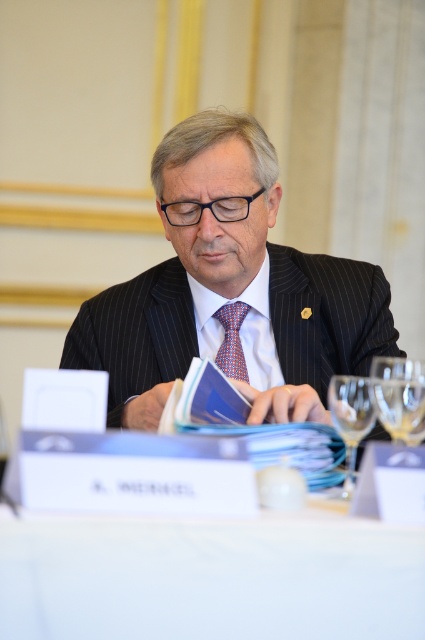
Who is higher up, white fabric table at center or transparent glass at right?

transparent glass at right is above.

Find the location of `white fabric table at center`. white fabric table at center is located at coordinates (209, 577).

Find the location of a particular element. The height and width of the screenshot is (640, 425). white fabric table at center is located at coordinates (209, 577).

Does white fabric table at center appear on the right side of transparent glass at lower right?

No, white fabric table at center is not to the right of transparent glass at lower right.

Does white fabric table at center lie in front of transparent glass at lower right?

Yes, it is in front of transparent glass at lower right.

Is point (418, 566) positioned after point (357, 445)?

No.

Identify the location of white fabric table at center. This screenshot has width=425, height=640. (209, 577).

Does point (365, 396) come behind point (227, 333)?

No, it is not.

Can you confirm if transparent glass at lower right is positioned to the left of multicolored woven tie at center?

In fact, transparent glass at lower right is to the right of multicolored woven tie at center.

Locate an element on the screen. This screenshot has width=425, height=640. transparent glass at lower right is located at coordinates (350, 419).